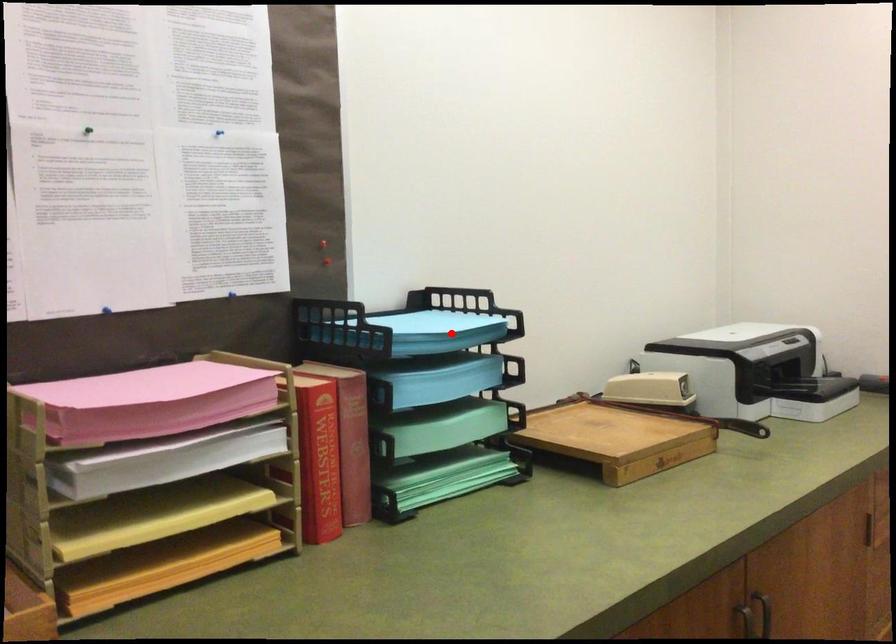
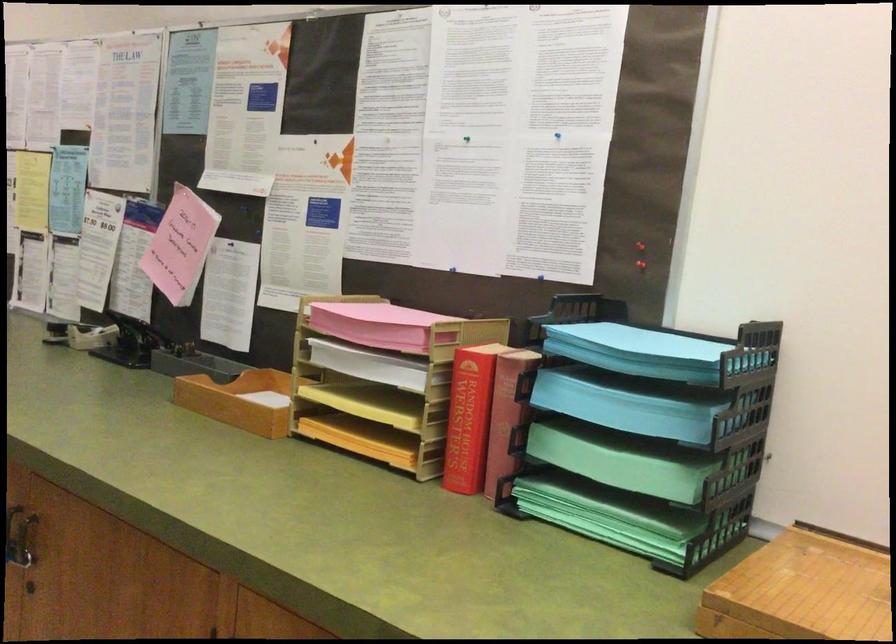
Question: A red point is marked in image1. In image2, is the corresponding 3D point closer to the camera or farther? Reply with the corresponding letter.

Choices:
 (A) The corresponding 3D point is closer.
 (B) The corresponding 3D point is farther.

Answer: (A)